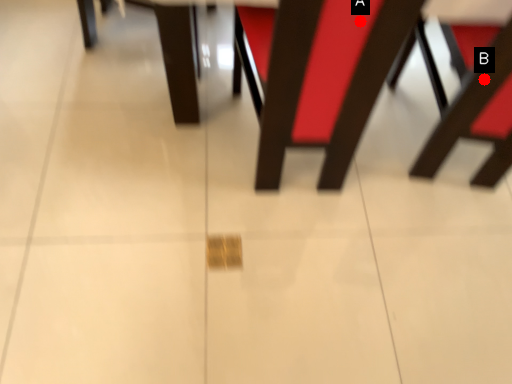
Question: Two points are circled on the image, labeled by A and B beside each circle. Which of the following is the closest to the observer?

Choices:
 (A) A is closer
 (B) B is closer

Answer: (A)